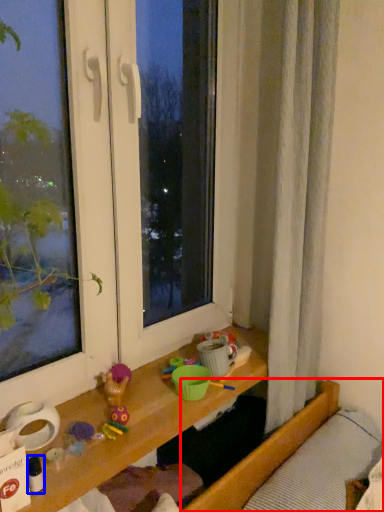
Question: Which point is further to the camera, bed (highlighted by a red box) or toy (highlighted by a blue box)?

Choices:
 (A) bed
 (B) toy

Answer: (A)